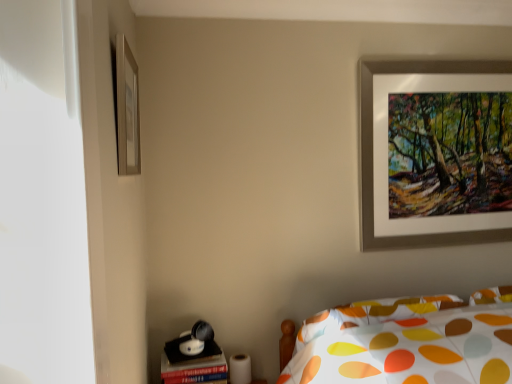
I want to click on vacant space situated above matte black table at lower left (from a real-world perspective), so click(190, 361).